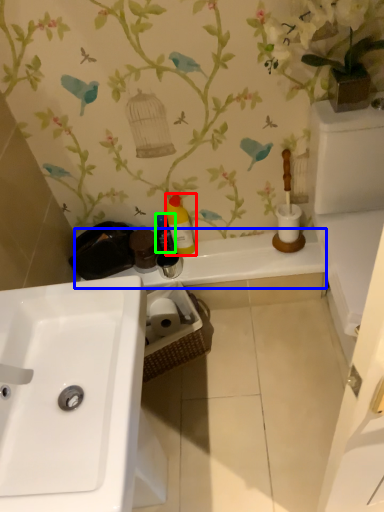
Question: Based on their relative distances, which object is nearer to cleaning product (highlighted by a red box)? Choose from counter top (highlighted by a blue box) and cleaning product (highlighted by a green box).

Choices:
 (A) counter top
 (B) cleaning product

Answer: (B)